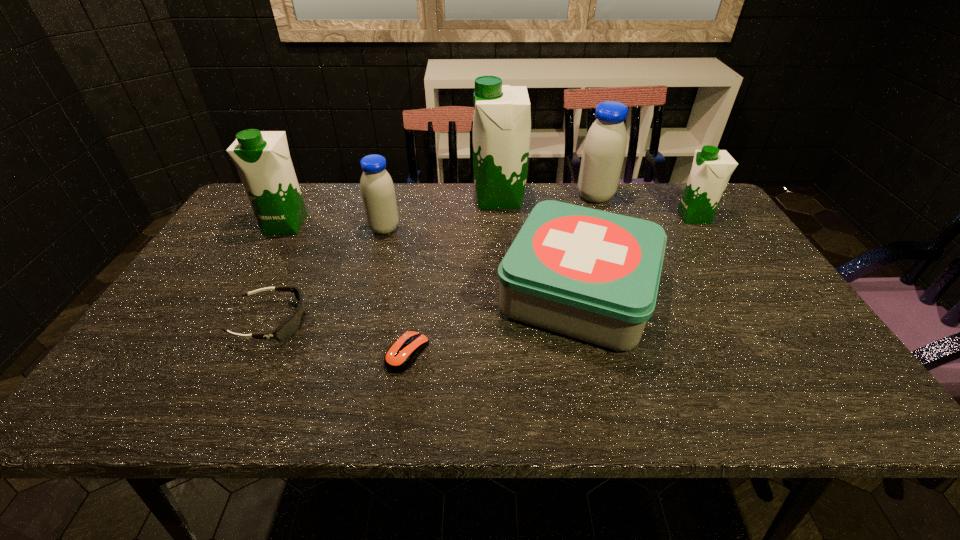
Identify the location of unoccupied area between the orange computer mouse and the goggles. (340, 338).

I want to click on vacant area that lies between the leftmost green soya milk and the teal first-aid kit, so [x=432, y=258].

Locate an element on the screen. free point between the seventh tallest object and the second green soya milk from left to right is located at coordinates (386, 260).

Locate an element on the screen. Image resolution: width=960 pixels, height=540 pixels. free space between the leftmost green soya milk and the second shortest object is located at coordinates pyautogui.click(x=279, y=273).

Locate an element on the screen. This screenshot has width=960, height=540. object that stands as the fourth closest to the right blue soya milk is located at coordinates (377, 190).

Where is `the seventh closest object relative to the third shortest object`? The height and width of the screenshot is (540, 960). the seventh closest object relative to the third shortest object is located at coordinates (262, 158).

Find the location of a particular element. This screenshot has height=540, width=960. the fourth closest soya milk to the second green soya milk from left to right is located at coordinates (262, 158).

Image resolution: width=960 pixels, height=540 pixels. In order to click on soya milk that is the fourth closest to the tallest object in this screenshot , I will do `click(262, 158)`.

Identify the location of green soya milk that is the nearest to the second smallest green soya milk. The image size is (960, 540). (502, 116).

This screenshot has height=540, width=960. Identify the location of the closest green soya milk relative to the third soya milk from left to right. (711, 169).